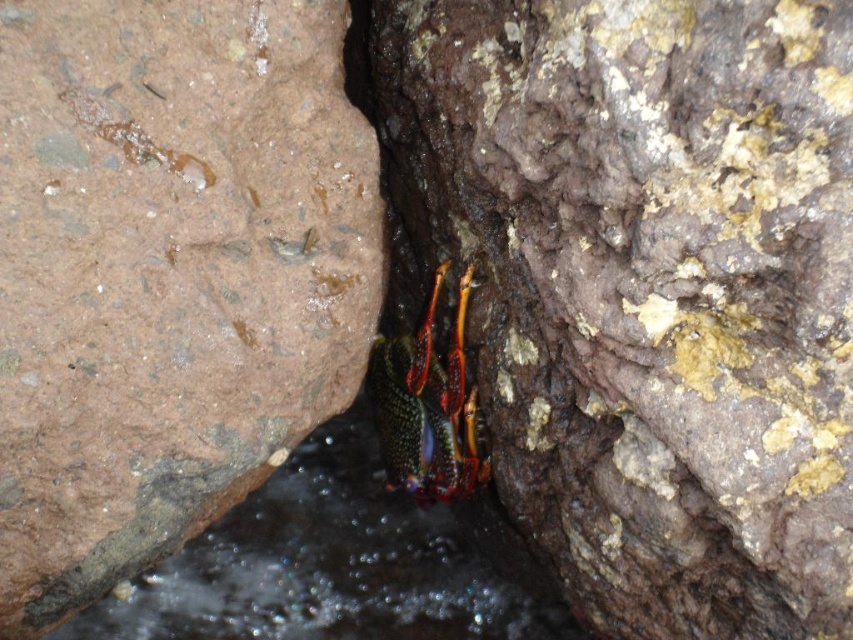
You are holding a camera and want to take a closeup photo of the brown rough rock at left. The camera requires a minimum distance of 36 inches to focus properly. Will the current distance allow the camera to focus?

The distance between the brown rough rock at left and the camera is 36.74 inches, which is just above the minimum required 36 inches. Therefore, the camera can focus on the brown rough rock at left.

You are a small insect trying to climb from the brown rough rock at left to the shiny metallic hermit crab at center. Which object is higher, making your climb more challenging?

The brown rough rock at left is taller than the shiny metallic hermit crab at center, so climbing from the rock to the crab would involve descending rather than ascending. The rock is the higher point in this scenario.

You are a photographer taking a close look at the crab in the rocky crevice. You notice two points marked in the image. Which point is closer to your camera lens, point (242, 221) or point (489, 464)?

Point (242, 221) is closer to the camera than point (489, 464).